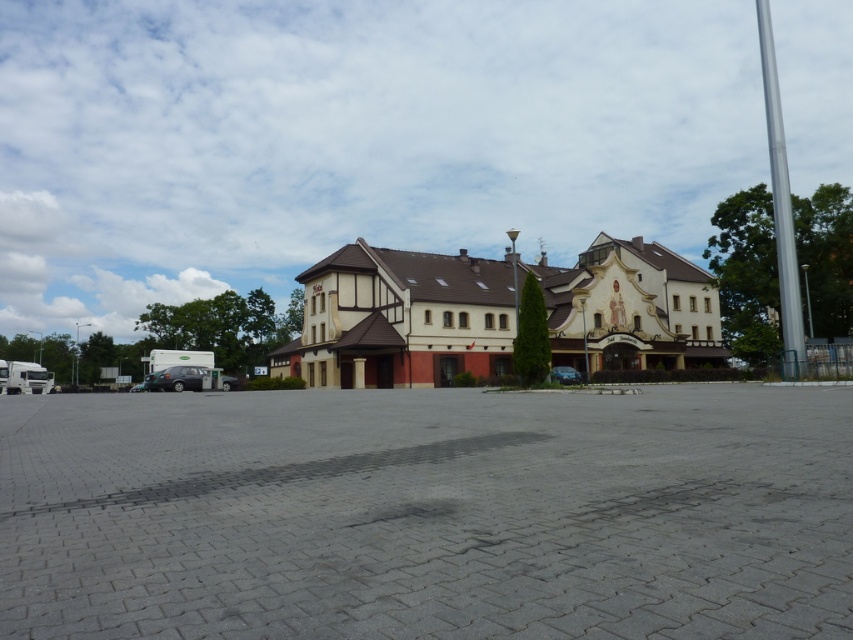
Question: Which point is closer to the camera?

Choices:
 (A) white metallic truck at lower left
 (B) gray concrete parking lot at center

Answer: (B)

Question: Observing the image, what is the correct spatial positioning of gray concrete parking lot at center in reference to white metallic truck at lower left?

Choices:
 (A) below
 (B) above

Answer: (B)

Question: Does gray concrete parking lot at center have a greater width compared to beige brick building at center?

Choices:
 (A) yes
 (B) no

Answer: (B)

Question: Which point is farther to the camera?

Choices:
 (A) (555, 378)
 (B) (39, 374)

Answer: (B)

Question: Is gray concrete parking lot at center below matte black car at lower left?

Choices:
 (A) yes
 (B) no

Answer: (B)

Question: Which of the following is the farthest from the observer?

Choices:
 (A) (469, 529)
 (B) (708, 298)
 (C) (556, 378)

Answer: (B)